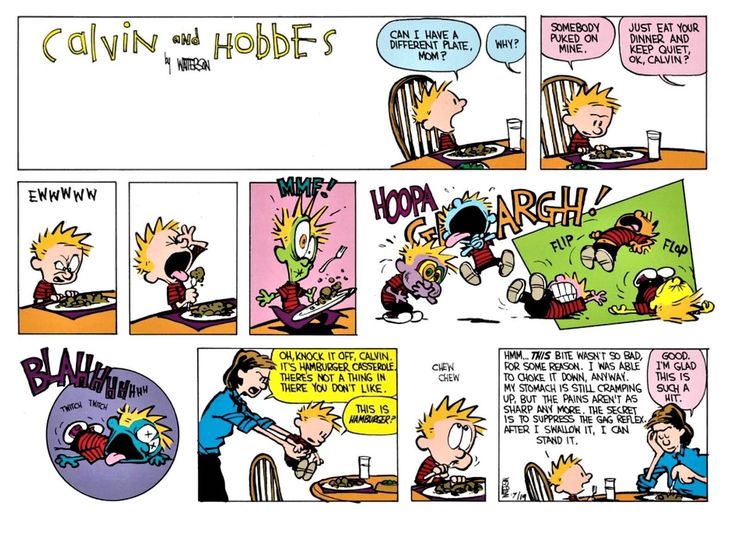
Image resolution: width=735 pixels, height=535 pixels. In order to click on frame in this screenshot , I will do `click(129, 464)`, `click(265, 441)`, `click(445, 429)`, `click(559, 421)`, `click(589, 262)`, `click(301, 255)`, `click(201, 264)`, `click(46, 268)`, `click(417, 112)`, `click(609, 106)`.